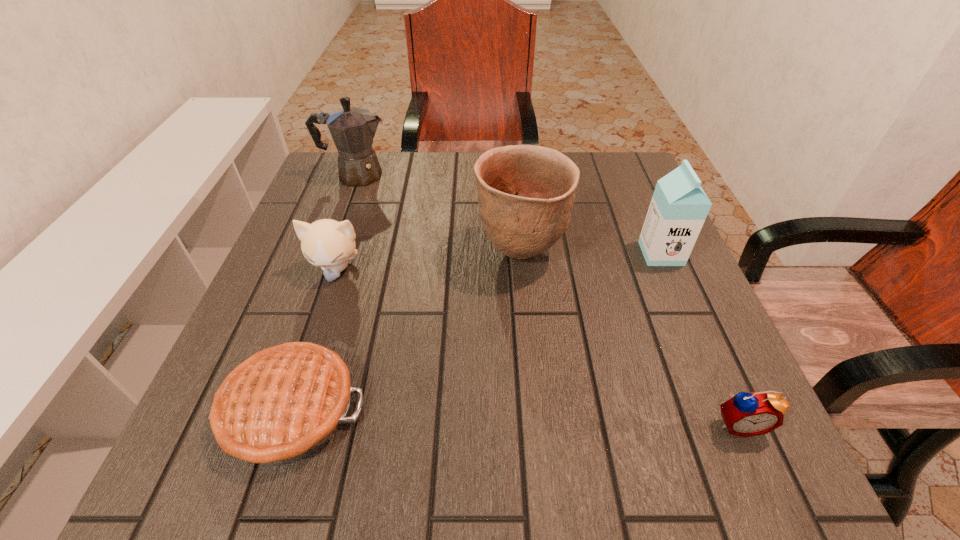
Find the location of `object that is at the near left corner`. object that is at the near left corner is located at coordinates (282, 404).

Image resolution: width=960 pixels, height=540 pixels. What are the coordinates of `object present at the near right corner` in the screenshot? It's located at (745, 414).

This screenshot has height=540, width=960. In the image, there is a desktop. Find the location of `vacant space at the left edge`. vacant space at the left edge is located at coordinates (x=303, y=290).

This screenshot has height=540, width=960. Identify the location of vacant space at the right edge. (655, 272).

In order to click on vacant space at the near left corner in this screenshot , I will do `click(212, 442)`.

At what (x,y) coordinates should I click in order to perform the action: click on vacant space at the far right corner of the desktop. Please return your answer as a coordinate pair (x, y). Looking at the image, I should click on (600, 168).

Where is `free space between the alarm clock and the third object from right to left`? The height and width of the screenshot is (540, 960). free space between the alarm clock and the third object from right to left is located at coordinates (630, 338).

Image resolution: width=960 pixels, height=540 pixels. Identify the location of free area in between the milk carton and the kitten. (498, 261).

At what (x,y) coordinates should I click in order to perform the action: click on free space between the kitten and the pie. Please return your answer as a coordinate pair (x, y). This screenshot has width=960, height=540. Looking at the image, I should click on pos(314,340).

Where is `free space that is in between the pie and the alarm clock`? free space that is in between the pie and the alarm clock is located at coordinates (515, 417).